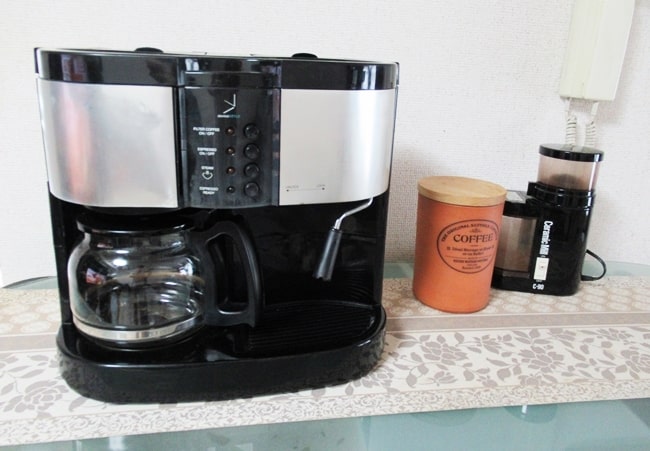
This screenshot has width=650, height=451. I want to click on handle, so click(x=329, y=260).